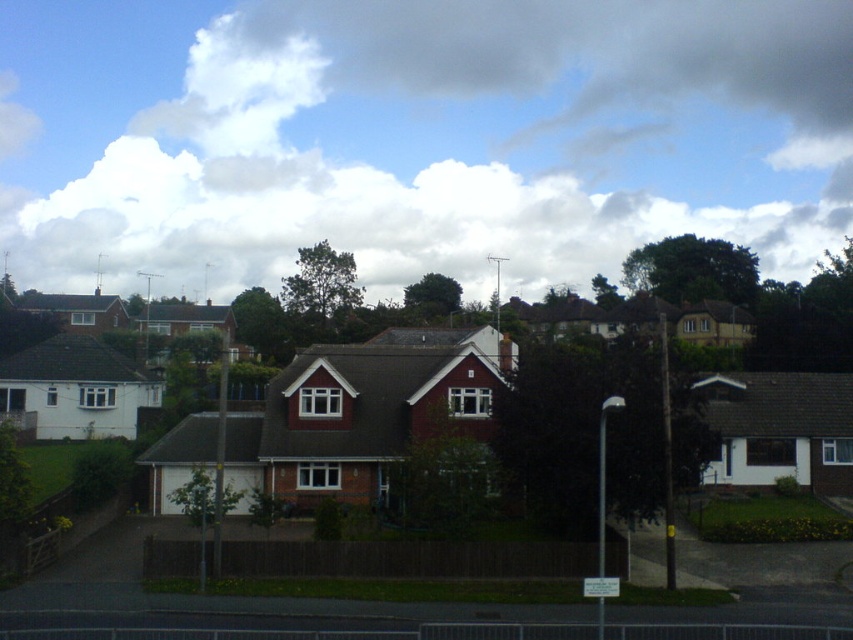
Between white fluffy cloud at upper center and brown wooden fence at center, which one appears on the right side from the viewer's perspective?

brown wooden fence at center is more to the right.

Who is more distant from viewer, (624, 214) or (381, 560)?

The point (624, 214) is more distant.

Image resolution: width=853 pixels, height=640 pixels. Describe the element at coordinates (415, 138) in the screenshot. I see `white fluffy cloud at upper center` at that location.

Locate an element on the screen. The image size is (853, 640). white fluffy cloud at upper center is located at coordinates (415, 138).